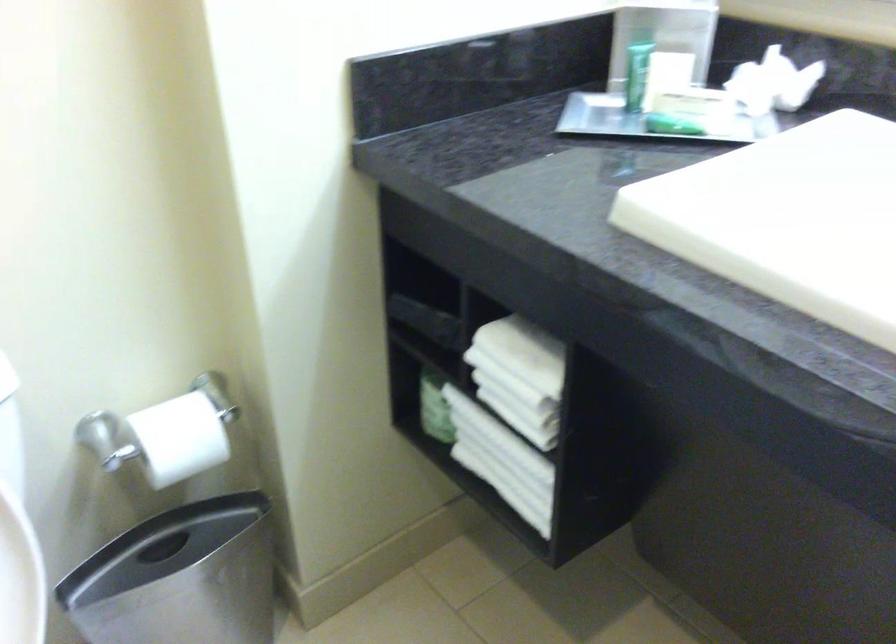
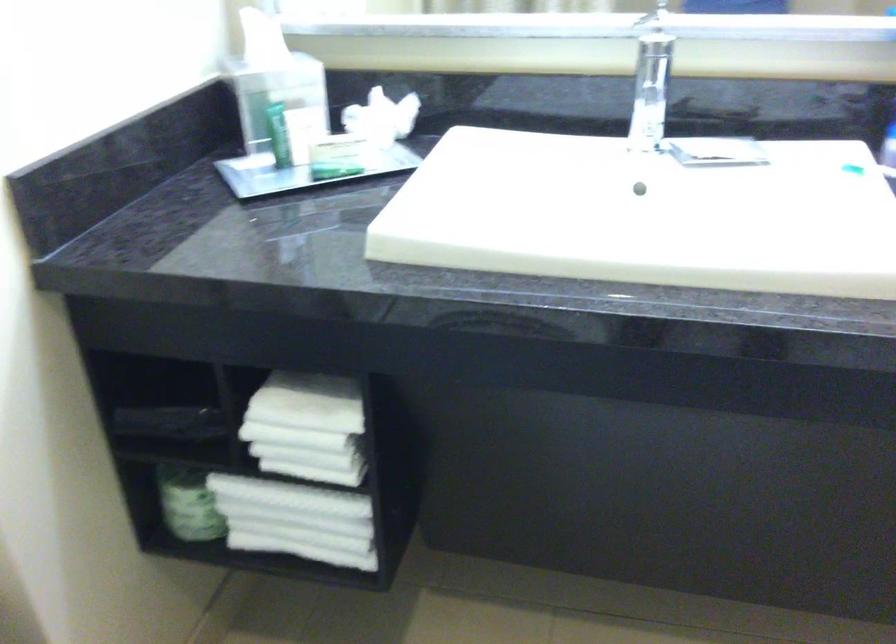
Where in the second image is the point corresponding to [632,76] from the first image?

(279, 134)